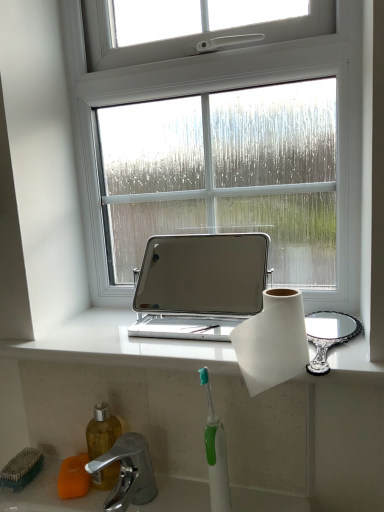
Question: From a real-world perspective, does silver metallic laptop at center sit lower than chrome metallic faucet at lower left?

Choices:
 (A) yes
 (B) no

Answer: (B)

Question: Considering the relative sizes of silver metallic laptop at center and chrome metallic faucet at lower left in the image provided, is silver metallic laptop at center bigger than chrome metallic faucet at lower left?

Choices:
 (A) no
 (B) yes

Answer: (B)

Question: Is silver metallic laptop at center at the right side of chrome metallic faucet at lower left?

Choices:
 (A) no
 (B) yes

Answer: (B)

Question: Is chrome metallic faucet at lower left a part of silver metallic laptop at center?

Choices:
 (A) no
 (B) yes

Answer: (A)

Question: Is silver metallic laptop at center oriented away from chrome metallic faucet at lower left?

Choices:
 (A) yes
 (B) no

Answer: (B)

Question: Can you confirm if silver metallic laptop at center is shorter than chrome metallic faucet at lower left?

Choices:
 (A) yes
 (B) no

Answer: (B)

Question: Is green plastic toothbrush at lower center in contact with green bristle brush at lower left?

Choices:
 (A) yes
 (B) no

Answer: (B)

Question: From a real-world perspective, is green plastic toothbrush at lower center on green bristle brush at lower left?

Choices:
 (A) yes
 (B) no

Answer: (A)

Question: From a real-world perspective, is green plastic toothbrush at lower center beneath green bristle brush at lower left?

Choices:
 (A) yes
 (B) no

Answer: (B)

Question: From the image's perspective, is green plastic toothbrush at lower center over green bristle brush at lower left?

Choices:
 (A) yes
 (B) no

Answer: (A)

Question: Does green plastic toothbrush at lower center have a greater width compared to green bristle brush at lower left?

Choices:
 (A) no
 (B) yes

Answer: (A)

Question: Considering the relative sizes of green plastic toothbrush at lower center and green bristle brush at lower left in the image provided, is green plastic toothbrush at lower center smaller than green bristle brush at lower left?

Choices:
 (A) yes
 (B) no

Answer: (B)

Question: Is white marble window sill at center not inside orange sponge at lower left?

Choices:
 (A) yes
 (B) no

Answer: (A)